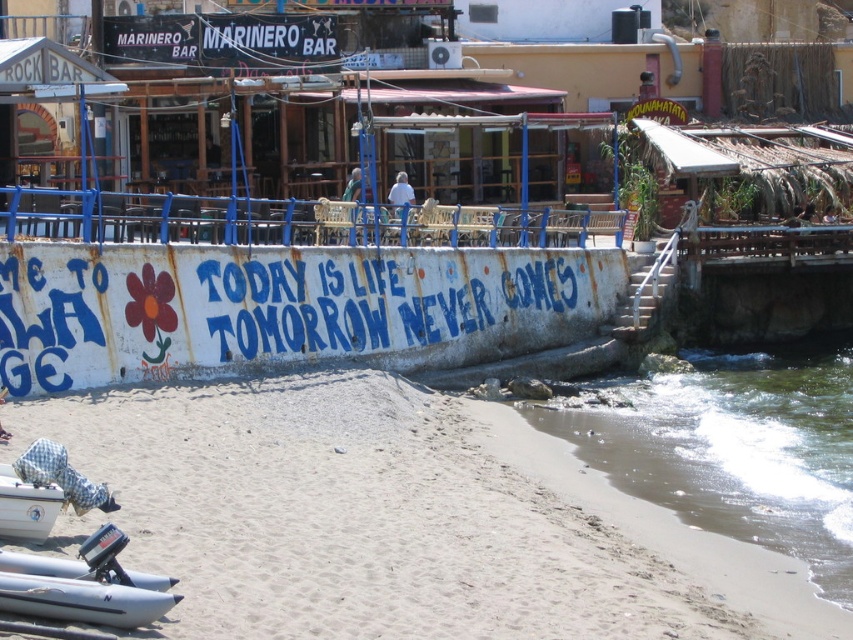
Question: Which is nearer to the white matte boat at lower left?

Choices:
 (A) white sandy beach at lower left
 (B) white rubber boat at lower left

Answer: (B)

Question: Is the position of white sandy beach at lower left less distant than that of clear water at lower right?

Choices:
 (A) yes
 (B) no

Answer: (A)

Question: Which point is farther to the camera?

Choices:
 (A) (45, 492)
 (B) (614, 637)
 (C) (753, 465)

Answer: (C)

Question: Does white rubber boat at lower left appear on the right side of white matte boat at lower left?

Choices:
 (A) yes
 (B) no

Answer: (A)

Question: Does clear water at lower right have a larger size compared to white rubber boat at lower left?

Choices:
 (A) yes
 (B) no

Answer: (A)

Question: Which point is closer to the camera taking this photo?

Choices:
 (A) (759, 420)
 (B) (416, 472)
 (C) (22, 500)

Answer: (C)